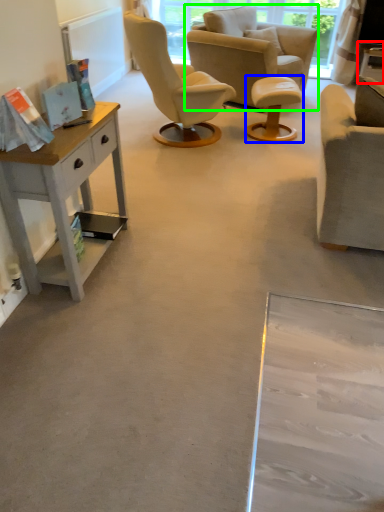
Question: Based on their relative distances, which object is nearer to side table (highlighted by a red box)? Choose from stool (highlighted by a blue box) and chair (highlighted by a green box).

Choices:
 (A) stool
 (B) chair

Answer: (A)